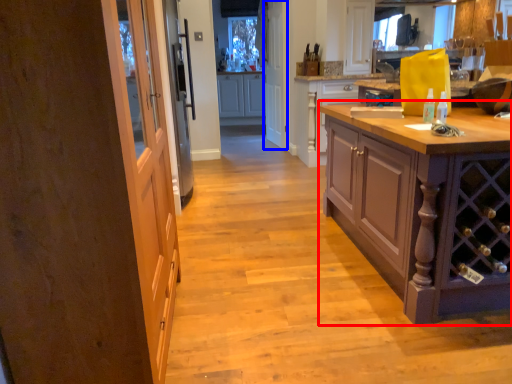
Question: Which of the following is the closest to the observer, cabinetry (highlighted by a red box) or screen door (highlighted by a blue box)?

Choices:
 (A) cabinetry
 (B) screen door

Answer: (A)